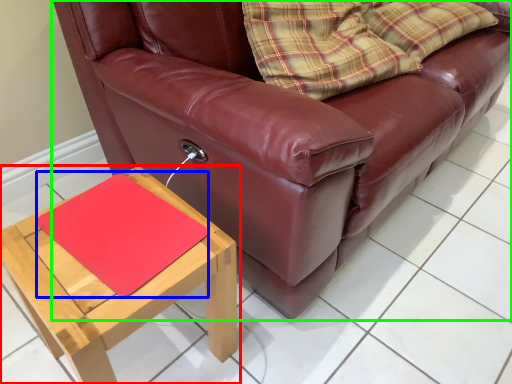
Question: Considering the real-world distances, which object is farthest from table (highlighted by a red box)? mat (highlighted by a blue box) or studio couch (highlighted by a green box)?

Choices:
 (A) mat
 (B) studio couch

Answer: (B)